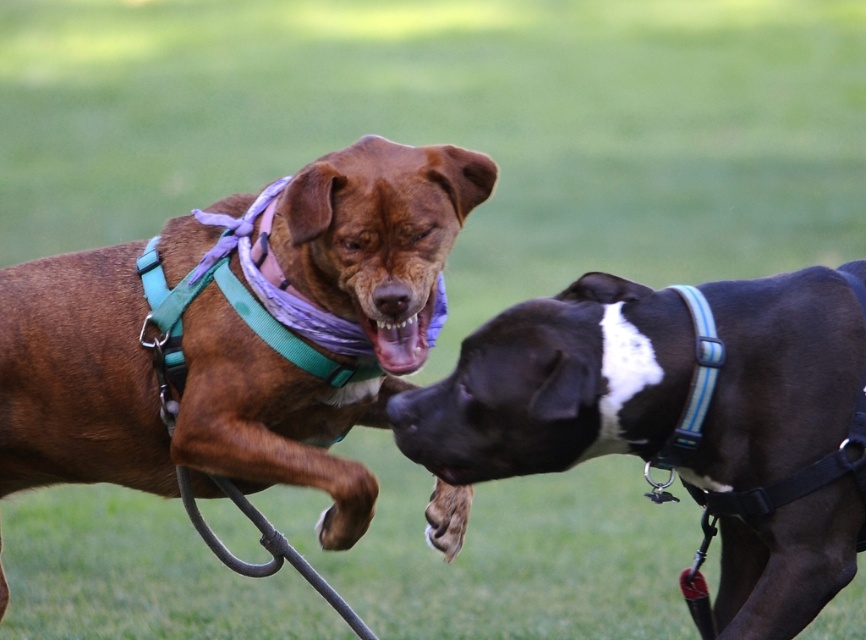
You are a dog owner who wants to buy a new collar for both dogs. The matte brown dog mouth at center is currently wearing a teal harness and purple scarf. The black smooth dog at right has a blue and black harness. If you want to ensure the collars match their harness colors, which colors should the collars be for each dog?

The matte brown dog mouth at center should have a teal collar to match its teal harness, and the black smooth dog at right should have a blue and black collar to match its blue and black harness.

You are a dog owner trying to locate your dog in the park. Your dog is wearing a brown leather harness at center. Which direction should you walk to find the black smooth dog at right?

The black smooth dog at right is behind the brown leather harness at center, so you should walk towards the direction of the black smooth dog at right to find it behind the brown leather harness at center.